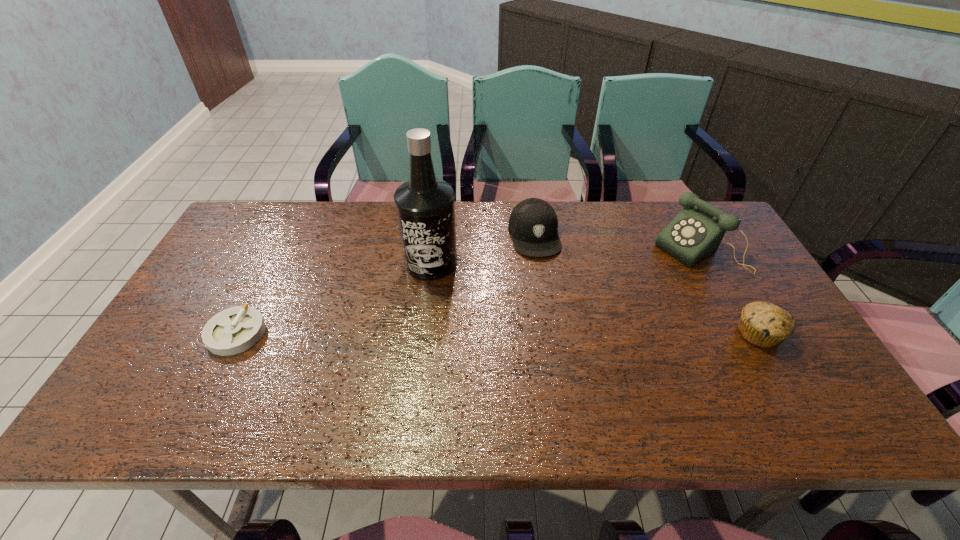
In order to click on vacant area that lies between the third object from left to right and the muffin in this screenshot , I will do `click(646, 285)`.

Image resolution: width=960 pixels, height=540 pixels. What are the coordinates of `free spot between the muffin and the fourth object from right to left` in the screenshot? It's located at (595, 298).

Where is `empty space between the muffin and the third object from left to right`? The image size is (960, 540). empty space between the muffin and the third object from left to right is located at coordinates (646, 285).

Locate an element on the screen. free space between the second tallest object and the cap is located at coordinates (616, 242).

Where is `vacant area between the fourth shortest object and the cap`? The height and width of the screenshot is (540, 960). vacant area between the fourth shortest object and the cap is located at coordinates (616, 242).

Find the location of a particular element. The width and height of the screenshot is (960, 540). empty space that is in between the muffin and the leftmost object is located at coordinates (497, 333).

At what (x,y) coordinates should I click in order to perform the action: click on free space between the shortest object and the muffin. Please return your answer as a coordinate pair (x, y). Image resolution: width=960 pixels, height=540 pixels. Looking at the image, I should click on (497, 333).

Locate an element on the screen. unoccupied area between the muffin and the fourth object from right to left is located at coordinates (595, 298).

This screenshot has width=960, height=540. Find the location of `unoccupied area between the tallest object and the cap`. unoccupied area between the tallest object and the cap is located at coordinates (483, 249).

Find the location of a particular element. The height and width of the screenshot is (540, 960). empty location between the muffin and the cap is located at coordinates (646, 285).